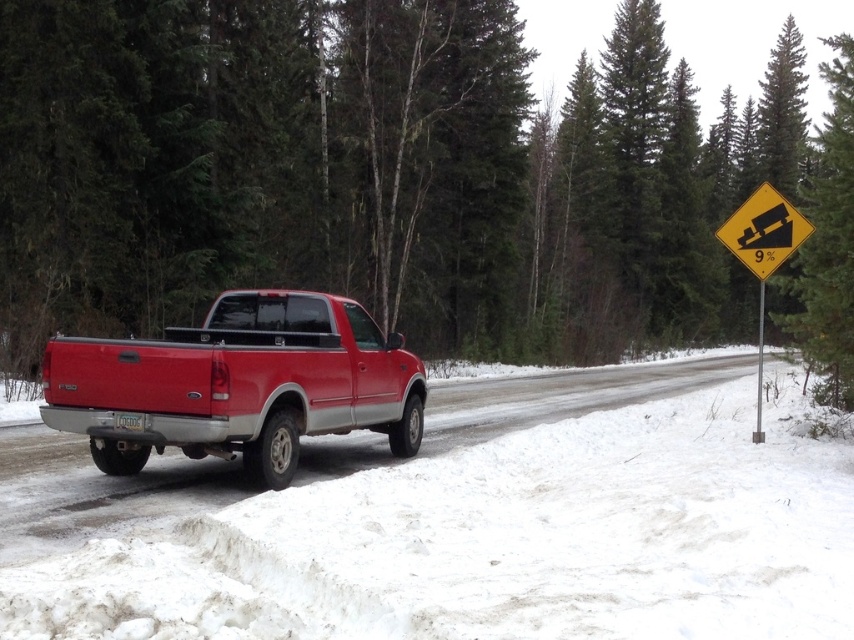
Question: Which object appears closest to the camera in this image?

Choices:
 (A) shiny red pickup truck at center
 (B) yellow reflective diamond at upper right
 (C) yellow reflective diamond at right
 (D) white powdery snow at lower center

Answer: (D)

Question: Among these objects, which one is farthest from the camera?

Choices:
 (A) white powdery snow at lower center
 (B) yellow reflective diamond at right

Answer: (B)

Question: Does white powdery snow at lower center have a lesser width compared to yellow reflective diamond at right?

Choices:
 (A) yes
 (B) no

Answer: (A)

Question: Is green matte tree at center to the left of yellow reflective diamond at right from the viewer's perspective?

Choices:
 (A) no
 (B) yes

Answer: (A)

Question: Can you confirm if green matte tree at center is positioned to the left of yellow reflective diamond at upper right?

Choices:
 (A) yes
 (B) no

Answer: (B)

Question: Which of the following is the closest to the observer?

Choices:
 (A) yellow reflective diamond at upper right
 (B) shiny red pickup truck at center

Answer: (B)